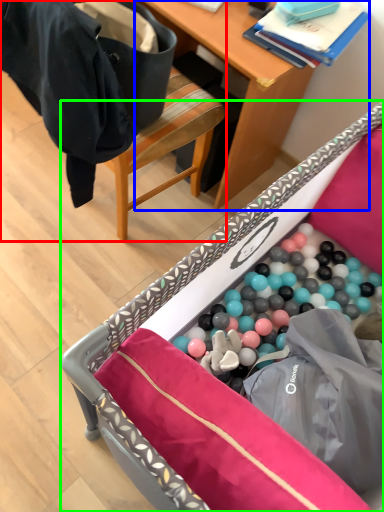
Question: Estimate the real-world distances between objects in this image. Which object is farther from chair (highlighted by a red box), desk (highlighted by a blue box) or furniture (highlighted by a green box)?

Choices:
 (A) desk
 (B) furniture

Answer: (B)